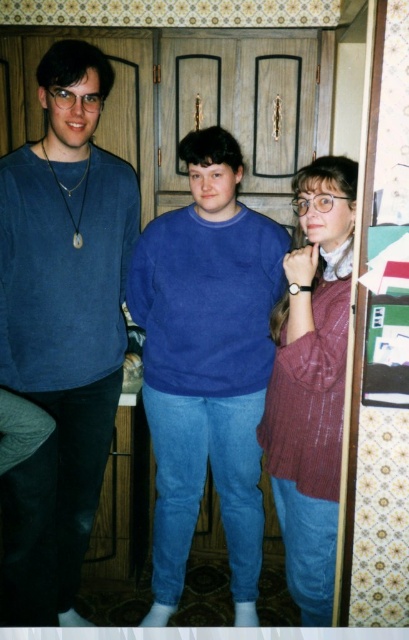
Looking at this image, does matte blue sweater at left lie in front of knitted maroon sweater at center?

That is False.

Does matte blue sweater at left appear on the left side of knitted maroon sweater at center?

Yes, matte blue sweater at left is to the left of knitted maroon sweater at center.

Does point (2, 566) come closer to viewer compared to point (336, 216)?

No, it is behind (336, 216).

I want to click on matte blue sweater at left, so click(x=62, y=326).

Can you confirm if blue cotton sweater at center is bigger than knitted maroon sweater at center?

Yes.

Which is in front, point (195, 467) or point (278, 387)?

Point (278, 387)

You are a GUI agent. You are given a task and a screenshot of the screen. Output one action in this format:
    pyautogui.click(x=<x>, y=<y>)
    Task: Click on the blue cotton sweater at center
    This screenshot has width=409, height=640.
    Given the screenshot: What is the action you would take?
    pyautogui.click(x=206, y=364)

Is point (96, 445) farther from viewer compared to point (247, 520)?

That is False.

Can you confirm if matte blue sweater at left is wider than blue cotton sweater at center?

No.

Is point (33, 145) positioned before point (265, 221)?

Yes, point (33, 145) is closer to viewer.

Find the location of `matte blue sweater at left`. matte blue sweater at left is located at coordinates pyautogui.click(x=62, y=326).